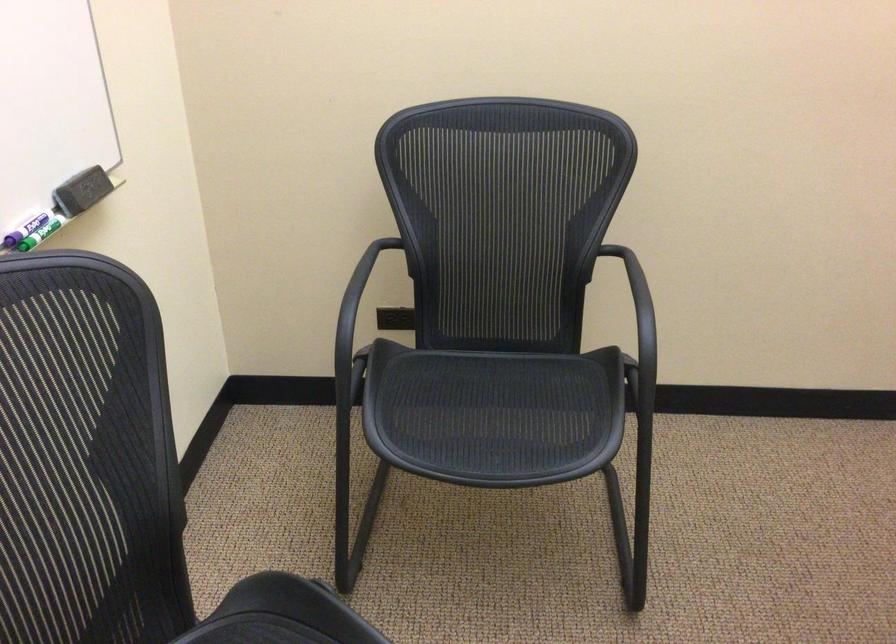
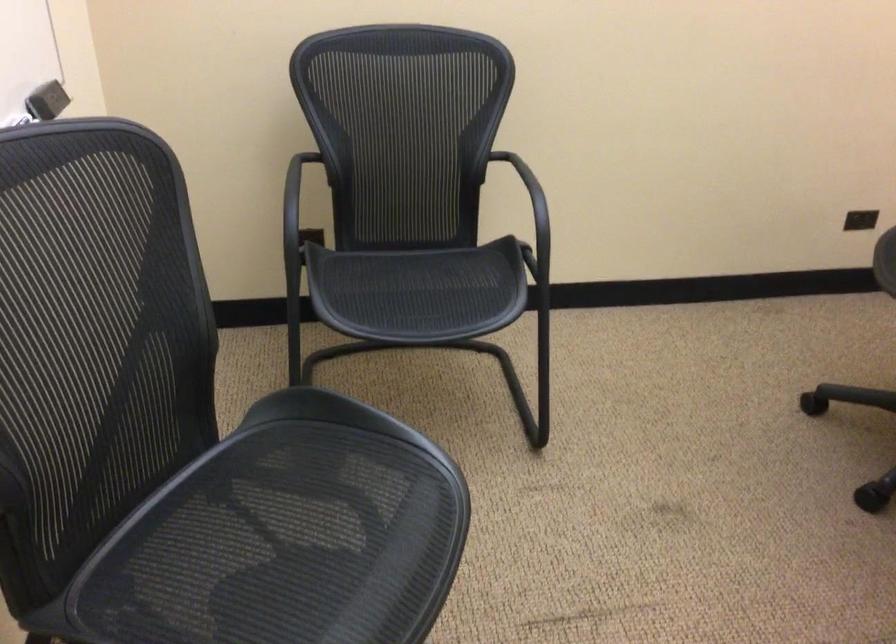
In a continuous first-person perspective shot, in which direction is the camera moving?

The cameraman moved toward left, backward.